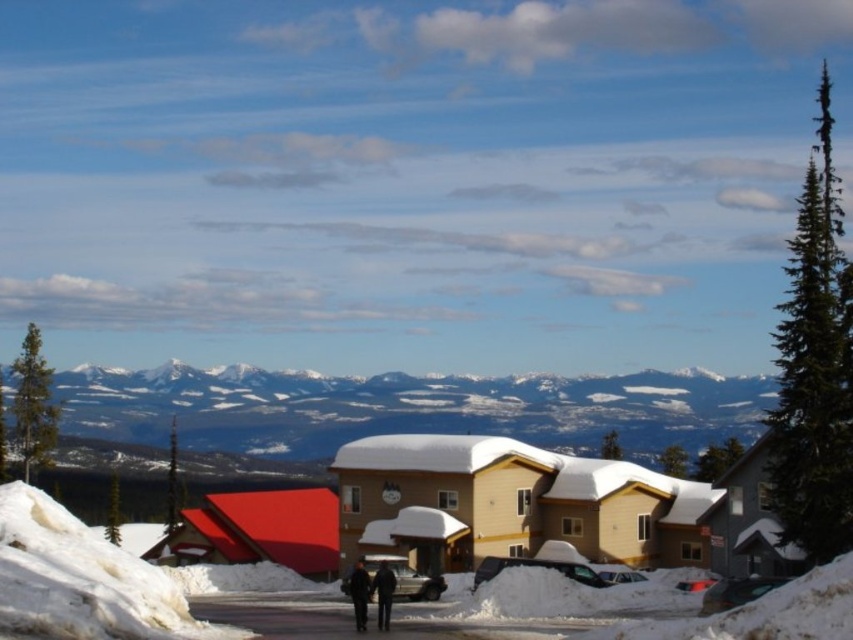
You are planning to build a small cabin in the winter scene. You have two options for the location. One is near the smooth snow ski slope at lower left and the other is near the dark blue jeans at center. Which location would provide more space for your cabin?

The smooth snow ski slope at lower left might be wider than dark blue jeans at center, so building near the smooth snow ski slope at lower left could offer more space for the cabin.

You are a photographer trying to capture both the beige wood ski resort at center and the black fabric jacket at center in a single frame. Since you want to emphasize the ski resort, which object should you position closer to the camera to ensure it appears larger in the photo?

To emphasize the beige wood ski resort at center, position it closer to the camera since its actual width is larger than the black fabric jacket at center, making it naturally appear bigger when framed.